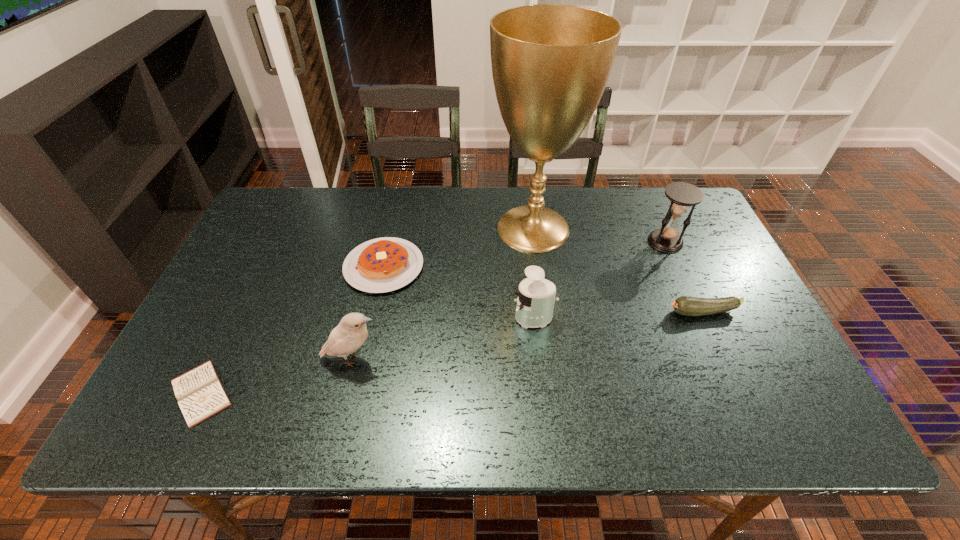
Locate an element on the screen. This screenshot has width=960, height=540. the tallest object is located at coordinates (551, 63).

Identify the location of hourglass. (682, 195).

Locate an element on the screen. This screenshot has width=960, height=540. juicer is located at coordinates (536, 296).

Identify the location of bird. (351, 333).

Image resolution: width=960 pixels, height=540 pixels. I want to click on zucchini, so click(x=687, y=306).

Locate an element on the screen. The width and height of the screenshot is (960, 540). pancake is located at coordinates (379, 265).

What are the coordinates of `the shortest object` in the screenshot? It's located at (200, 394).

Locate an element on the screen. Image resolution: width=960 pixels, height=540 pixels. diary is located at coordinates (200, 394).

Identify the location of vacant space located 0.090m on the right of the trophy cup. This screenshot has height=540, width=960. (609, 228).

The width and height of the screenshot is (960, 540). I want to click on free space located 0.300m on the front of the hourglass, so click(708, 337).